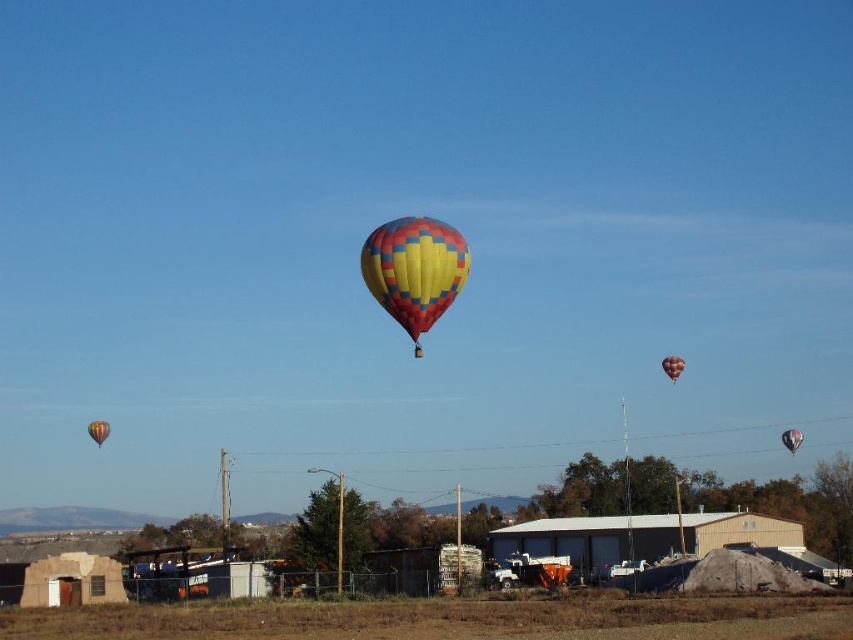
Question: Is multicolored fabric hot air balloon at center further to camera compared to multicolored fabric balloon at center?

Choices:
 (A) no
 (B) yes

Answer: (A)

Question: Among these points, which one is nearest to the camera?

Choices:
 (A) (672, 358)
 (B) (788, 451)
 (C) (96, 426)

Answer: (A)

Question: Does multicolored fabric hot air balloon at upper center appear on the right side of orange fabric balloon at center?

Choices:
 (A) no
 (B) yes

Answer: (B)

Question: Which point is farther to the camera?

Choices:
 (A) (785, 433)
 (B) (674, 372)
 (C) (90, 435)
 (D) (393, 240)

Answer: (A)

Question: Which of the following is the farthest from the observer?

Choices:
 (A) multicolored fabric balloon at center
 (B) multicolored fabric hot air balloon at center
 (C) orange fabric balloon at center

Answer: (C)

Question: Does multicolored fabric hot air balloon at center appear over multicolored fabric balloon at center?

Choices:
 (A) yes
 (B) no

Answer: (A)